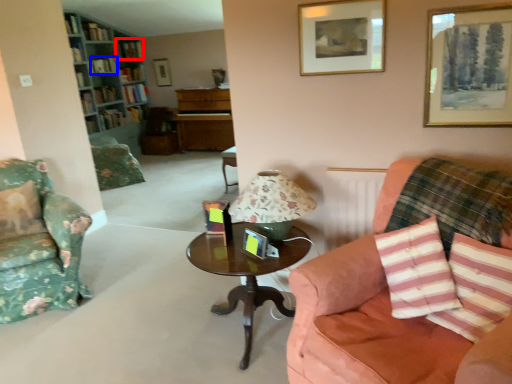
Question: Among these objects, which one is nearest to the camera, book (highlighted by a red box) or book (highlighted by a blue box)?

Choices:
 (A) book
 (B) book

Answer: (B)